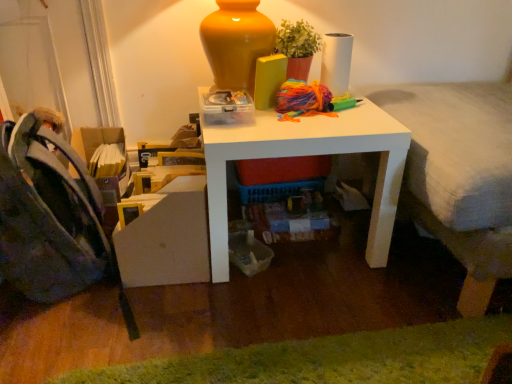
Find the location of a particular element. The height and width of the screenshot is (384, 512). blank space situated above green fuzzy rug at lower center (from a real-world perspective) is located at coordinates (329, 360).